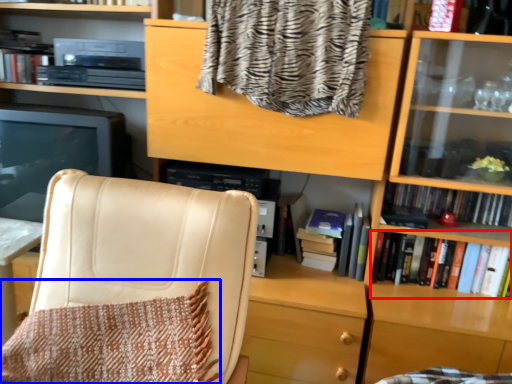
Question: Which point is closer to the camera, book (highlighted by a red box) or blanket (highlighted by a blue box)?

Choices:
 (A) book
 (B) blanket

Answer: (B)